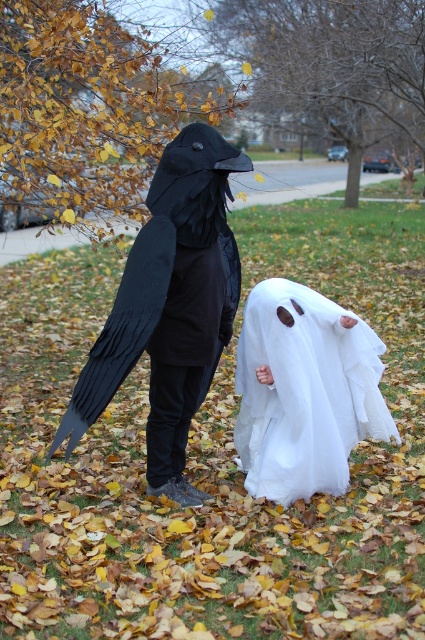
From the picture: You are a photographer trying to capture a closeup shot of the matte black bird at left and the white sheer fabric ghost at lower center. Your camera has a minimum focus distance of 20 inches. Can you get both subjects in focus without moving either of them?

The matte black bird at left is 21.12 inches from the white sheer fabric ghost at lower center. Since the minimum focus distance is 20 inches, the camera can focus on both subjects as the distance between them is within the required range.

You are a photographer standing in the scene and want to take a picture of both the matte black bird at left and the white sheer fabric ghost at lower center. Which one should you focus on first to ensure both are in sharp focus?

You should focus on the matte black bird at left first since it is closer to the viewer than the white sheer fabric ghost at lower center, so adjusting focus from near to far will help both be sharp.